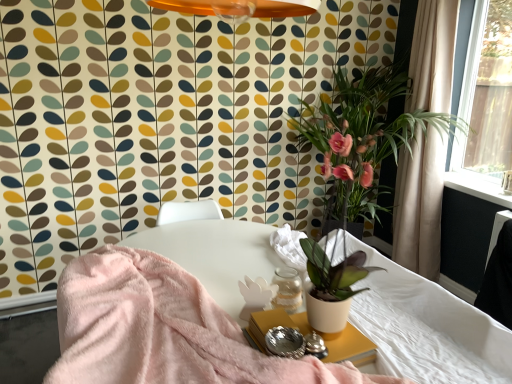
Question: Can you confirm if white matte side table at lower center is bigger than white fabric mattress at lower right?

Choices:
 (A) yes
 (B) no

Answer: (B)

Question: From the image's perspective, does white matte side table at lower center appear lower than white fabric mattress at lower right?

Choices:
 (A) yes
 (B) no

Answer: (B)

Question: Is white matte side table at lower center taller than white fabric mattress at lower right?

Choices:
 (A) yes
 (B) no

Answer: (B)

Question: Is white matte side table at lower center aimed at white fabric mattress at lower right?

Choices:
 (A) no
 (B) yes

Answer: (A)

Question: Is white matte side table at lower center closer to the viewer compared to white fabric mattress at lower right?

Choices:
 (A) no
 (B) yes

Answer: (B)

Question: From a real-world perspective, is matte white pot at center physically located above or below white matte side table at lower center?

Choices:
 (A) below
 (B) above

Answer: (B)

Question: Looking at the image, does matte white pot at center seem bigger or smaller compared to white matte side table at lower center?

Choices:
 (A) small
 (B) big

Answer: (B)

Question: Considering the positions of matte white pot at center and white matte side table at lower center in the image, is matte white pot at center taller or shorter than white matte side table at lower center?

Choices:
 (A) tall
 (B) short

Answer: (A)

Question: Is matte white pot at center wider or thinner than white matte side table at lower center?

Choices:
 (A) wide
 (B) thin

Answer: (A)

Question: Is white fabric mattress at lower right spatially inside beige fabric curtain at right, or outside of it?

Choices:
 (A) inside
 (B) outside

Answer: (B)

Question: Is point (369, 251) positioned closer to the camera than point (409, 62)?

Choices:
 (A) closer
 (B) farther

Answer: (A)

Question: From a real-world perspective, is white fabric mattress at lower right physically located above or below beige fabric curtain at right?

Choices:
 (A) below
 (B) above

Answer: (A)

Question: In terms of width, does white fabric mattress at lower right look wider or thinner when compared to beige fabric curtain at right?

Choices:
 (A) thin
 (B) wide

Answer: (B)

Question: From a real-world perspective, is white fabric mattress at lower right above or below white matte side table at lower center?

Choices:
 (A) above
 (B) below

Answer: (B)

Question: Relative to white matte side table at lower center, is white fabric mattress at lower right in front or behind?

Choices:
 (A) behind
 (B) front

Answer: (A)